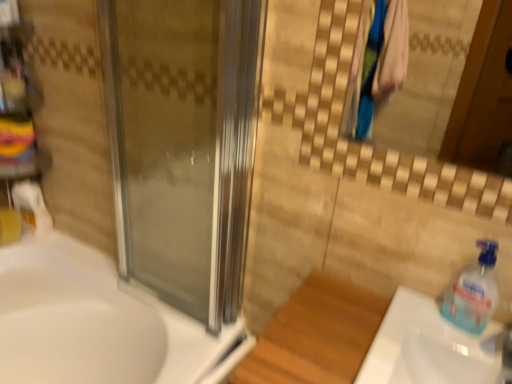
Where is `free spot to the left of transparent plastic soap dispenser at right`? free spot to the left of transparent plastic soap dispenser at right is located at coordinates (414, 322).